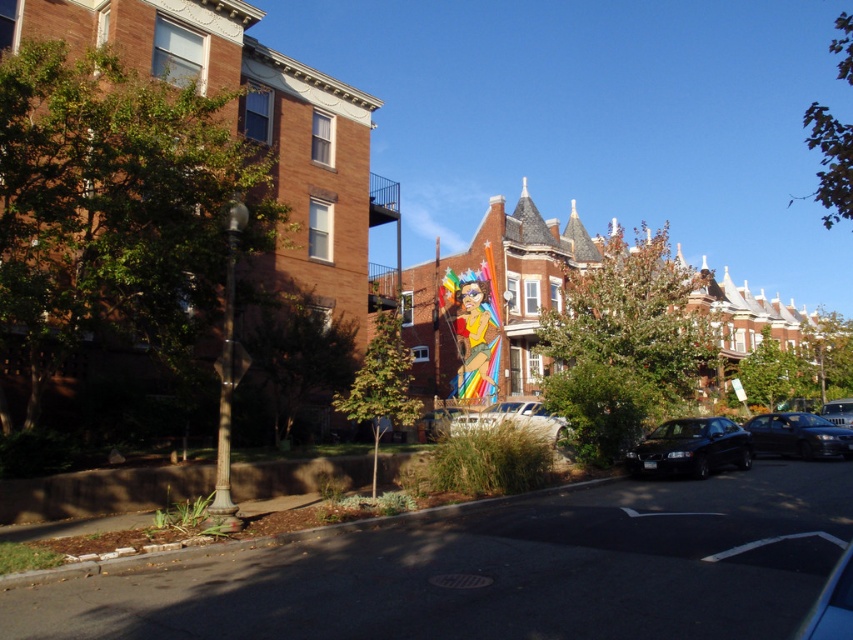
Consider the image. Which of these two, black glossy sedan at lower right or metallic silver car at center, stands taller?

Standing taller between the two is metallic silver car at center.

Can you confirm if black glossy sedan at lower right is positioned above metallic silver car at center?

Indeed, black glossy sedan at lower right is positioned over metallic silver car at center.

Does point (683, 436) come in front of point (433, 419)?

Yes.

What are the coordinates of `black glossy sedan at lower right` in the screenshot? It's located at (689, 448).

Who is more forward, (654, 461) or (834, 403)?

Point (654, 461) is more forward.

Does black glossy sedan at lower right appear over metallic silver car at right?

Correct, black glossy sedan at lower right is located above metallic silver car at right.

What do you see at coordinates (689, 448) in the screenshot? The image size is (853, 640). I see `black glossy sedan at lower right` at bounding box center [689, 448].

Locate an element on the screen. Image resolution: width=853 pixels, height=640 pixels. black glossy sedan at lower right is located at coordinates (689, 448).

Is point (833, 444) behind point (839, 410)?

No, it is not.

Which of these two, shiny black sedan at center right or metallic silver car at right, stands taller?

With more height is shiny black sedan at center right.

Which is behind, point (820, 426) or point (843, 412)?

The point (843, 412) is behind.

In order to click on shiny black sedan at center right in this screenshot , I will do `click(798, 435)`.